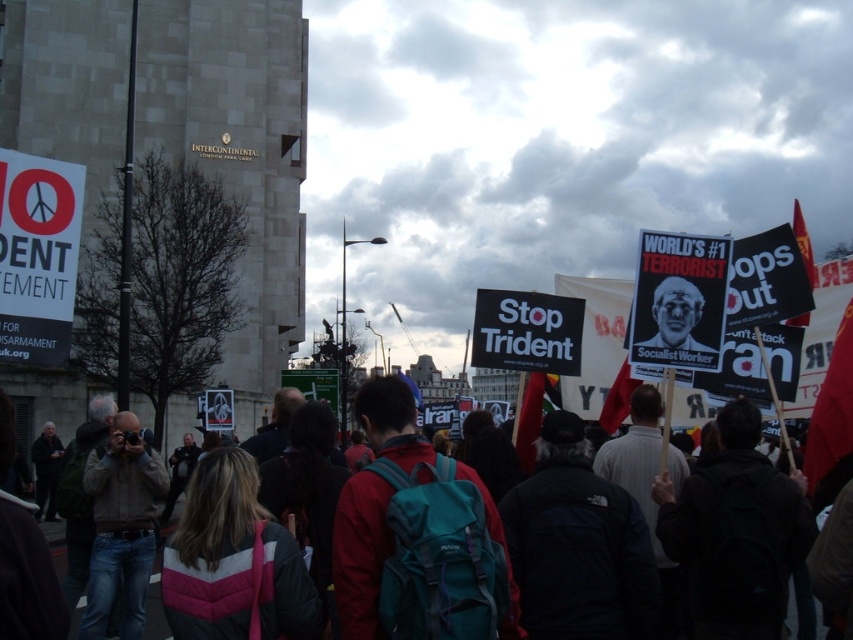
Question: Which point is farther to the camera?

Choices:
 (A) (689, 349)
 (B) (12, 621)

Answer: (A)

Question: Is teal fabric backpack at center wider than matte black poster at center?

Choices:
 (A) no
 (B) yes

Answer: (B)

Question: Does teal fabric backpack at center appear on the right side of matte black poster at center?

Choices:
 (A) no
 (B) yes

Answer: (A)

Question: From the image, what is the correct spatial relationship of teal fabric backpack at center in relation to matte black poster at center?

Choices:
 (A) above
 (B) below

Answer: (B)

Question: Which object is farther from the camera taking this photo?

Choices:
 (A) matte black poster at center
 (B) teal fabric backpack at center

Answer: (A)